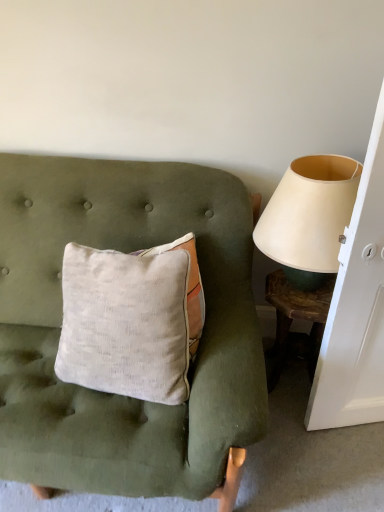
Question: Is wooden textured side table at right positioned far away from beige fabric lampshade at right?

Choices:
 (A) yes
 (B) no

Answer: (B)

Question: Considering the relative sizes of wooden textured side table at right and beige fabric lampshade at right in the image provided, is wooden textured side table at right smaller than beige fabric lampshade at right?

Choices:
 (A) yes
 (B) no

Answer: (A)

Question: Can you confirm if wooden textured side table at right is positioned to the right of beige fabric lampshade at right?

Choices:
 (A) no
 (B) yes

Answer: (B)

Question: Can you confirm if wooden textured side table at right is thinner than beige fabric lampshade at right?

Choices:
 (A) yes
 (B) no

Answer: (A)

Question: Is wooden textured side table at right aimed at beige fabric lampshade at right?

Choices:
 (A) yes
 (B) no

Answer: (B)

Question: Is beige fabric lampshade at right in front of or behind wooden textured side table at right in the image?

Choices:
 (A) front
 (B) behind

Answer: (A)

Question: From the image's perspective, relative to wooden textured side table at right, is beige fabric lampshade at right above or below?

Choices:
 (A) below
 (B) above

Answer: (B)

Question: Does point (297, 279) appear closer or farther from the camera than point (291, 306)?

Choices:
 (A) farther
 (B) closer

Answer: (A)

Question: Is beige fabric lampshade at right wider or thinner than wooden textured side table at right?

Choices:
 (A) thin
 (B) wide

Answer: (B)

Question: In terms of height, does wooden textured side table at right look taller or shorter compared to textured linen pillow at center?

Choices:
 (A) tall
 (B) short

Answer: (B)

Question: In the image, is wooden textured side table at right on the left side or the right side of textured linen pillow at center?

Choices:
 (A) left
 (B) right

Answer: (B)

Question: Looking at their shapes, would you say wooden textured side table at right is wider or thinner than textured linen pillow at center?

Choices:
 (A) wide
 (B) thin

Answer: (B)

Question: Considering the positions of point (296, 295) and point (144, 458), is point (296, 295) closer or farther from the camera than point (144, 458)?

Choices:
 (A) farther
 (B) closer

Answer: (A)

Question: Is textured linen pillow at center to the left or to the right of wooden textured side table at right in the image?

Choices:
 (A) right
 (B) left

Answer: (B)

Question: Based on their sizes in the image, would you say textured linen pillow at center is bigger or smaller than wooden textured side table at right?

Choices:
 (A) small
 (B) big

Answer: (B)